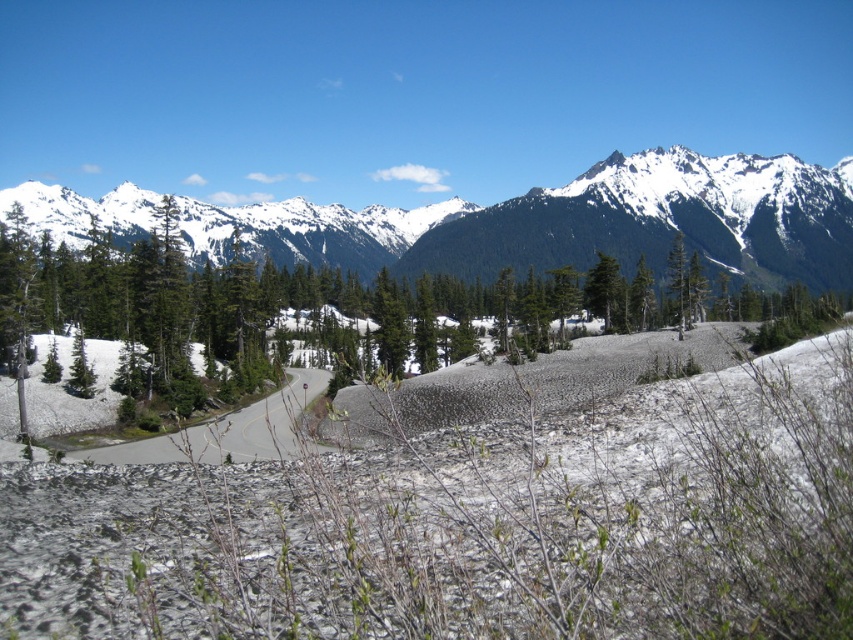
What do you see at coordinates (573, 224) in the screenshot? I see `snowy granite mountains at upper center` at bounding box center [573, 224].

Which is behind, point (538, 228) or point (305, 369)?

Positioned behind is point (538, 228).

Between point (79, 224) and point (206, 449), which one is positioned in front?

Positioned in front is point (206, 449).

Locate an element on the screen. The height and width of the screenshot is (640, 853). snowy granite mountains at upper center is located at coordinates (573, 224).

Based on the photo, who is more distant from viewer, (322, 342) or (282, 451)?

The point (322, 342) is behind.

Between point (216, 342) and point (312, 397), which one is positioned behind?

The point (216, 342) is behind.

Where is `green textured pine at center`? The height and width of the screenshot is (640, 853). green textured pine at center is located at coordinates [x=335, y=310].

Is green textured pine at center bigger than snowy granite mountains at upper center?

Incorrect, green textured pine at center is not larger than snowy granite mountains at upper center.

Consider the image. Does green textured pine at center lie behind snowy granite mountains at upper center?

No, it is in front of snowy granite mountains at upper center.

Image resolution: width=853 pixels, height=640 pixels. I want to click on green textured pine at center, so click(335, 310).